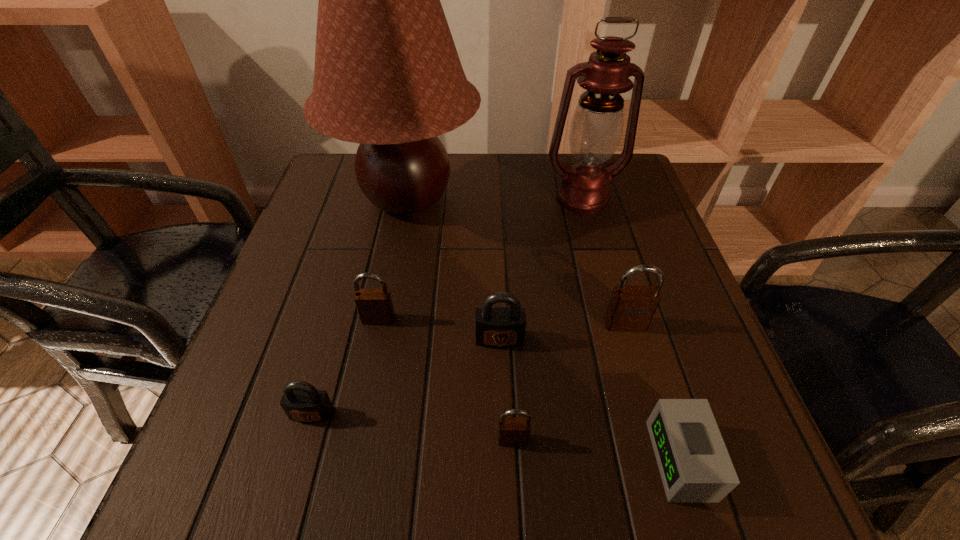
Where is `brown lampshade`? This screenshot has height=540, width=960. brown lampshade is located at coordinates (387, 75).

Find the location of `red oil lamp`. red oil lamp is located at coordinates (596, 127).

Find the location of a particular element. the tallest padlock is located at coordinates (631, 308).

Locate an element on the screen. the third tallest object is located at coordinates (631, 308).

Where is `the second padlock from left to right`? The image size is (960, 540). the second padlock from left to right is located at coordinates (374, 306).

Where is `the leftmost brown padlock`? Image resolution: width=960 pixels, height=540 pixels. the leftmost brown padlock is located at coordinates coord(374,306).

The width and height of the screenshot is (960, 540). Find the location of `the right gray padlock`. the right gray padlock is located at coordinates (499, 327).

You are a GUI agent. You are given a task and a screenshot of the screen. Output one action in this format:
    pyautogui.click(x=<x>, y=<y>)
    Task: Click on the bigger gray padlock
    
    Given the screenshot: What is the action you would take?
    pyautogui.click(x=499, y=327)

You are a GUI agent. You are given a task and a screenshot of the screen. Output one action in this format:
    pyautogui.click(x=<x>, y=<y>)
    Task: Click on the nearer gray padlock
    This screenshot has height=540, width=960.
    Given the screenshot: What is the action you would take?
    pyautogui.click(x=302, y=402)

You are a GUI agent. You are given a task and a screenshot of the screen. Output one action in this format:
    pyautogui.click(x=<x>, y=<y>)
    Task: Click on the second nearest padlock
    The height and width of the screenshot is (540, 960).
    Given the screenshot: What is the action you would take?
    pyautogui.click(x=302, y=402)